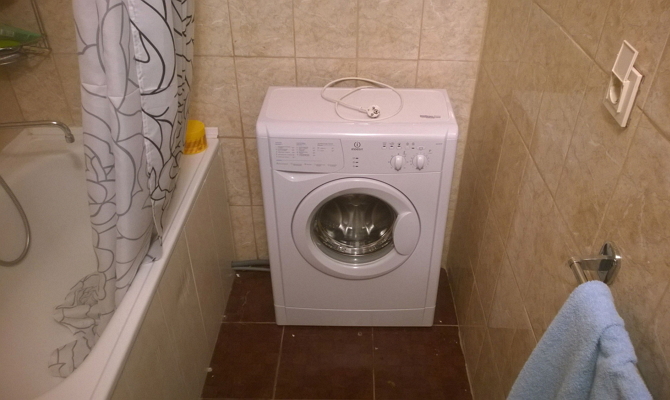
The height and width of the screenshot is (400, 670). Identify the location of washer cord. point(371,108).